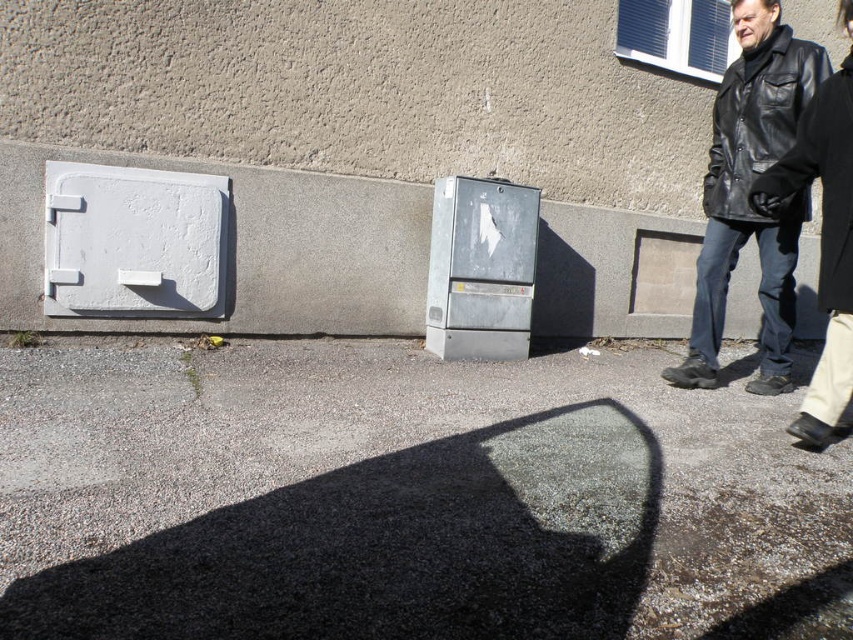
Who is positioned more to the left, gray gravel pavement at center or black leather jacket at right?

From the viewer's perspective, gray gravel pavement at center appears more on the left side.

Is point (683, 561) closer to viewer compared to point (828, 221)?

Yes, it is in front of point (828, 221).

Looking at this image, who is more forward, (64, 609) or (825, 138)?

Point (64, 609) is in front.

Image resolution: width=853 pixels, height=640 pixels. Identify the location of gray gravel pavement at center. (405, 499).

Between gray gravel pavement at center and black leather jacket at upper right, which one is positioned lower?

Positioned lower is gray gravel pavement at center.

Between gray gravel pavement at center and black leather jacket at upper right, which one appears on the right side from the viewer's perspective?

Positioned to the right is black leather jacket at upper right.

Is point (199, 586) more distant than point (799, 42)?

That is False.

The image size is (853, 640). Find the location of `gray gravel pavement at center`. gray gravel pavement at center is located at coordinates (405, 499).

Who is shorter, black leather jacket at upper right or black leather jacket at right?

black leather jacket at right

Locate an element on the screen. black leather jacket at upper right is located at coordinates (747, 193).

The height and width of the screenshot is (640, 853). I want to click on black leather jacket at upper right, so click(747, 193).